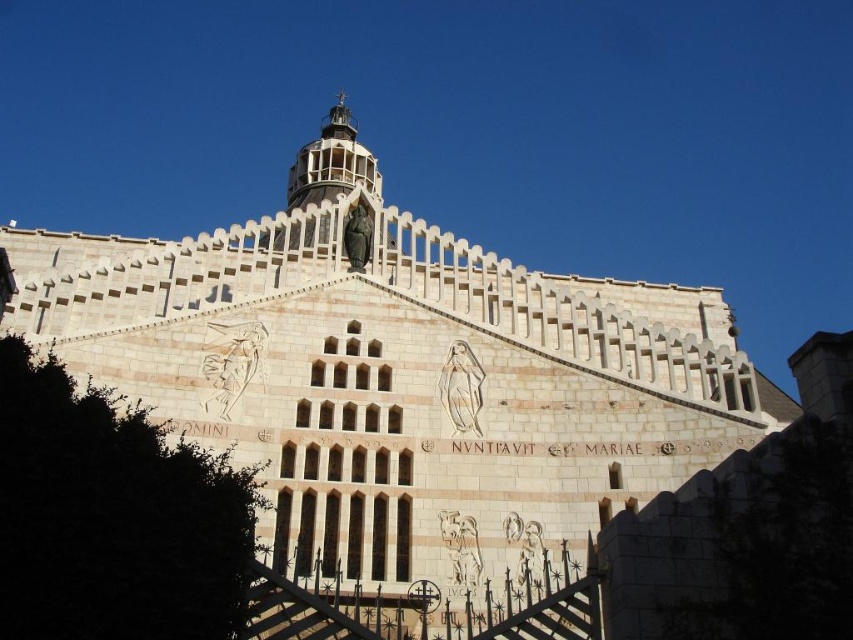
Question: Can you confirm if dark green leafy tree at lower left is bigger than white lattice tower at upper center?

Choices:
 (A) no
 (B) yes

Answer: (A)

Question: Which point is closer to the camera?

Choices:
 (A) (344, 173)
 (B) (172, 556)

Answer: (B)

Question: Is dark green leafy tree at lower left to the left of white lattice tower at upper center from the viewer's perspective?

Choices:
 (A) yes
 (B) no

Answer: (B)

Question: Is dark green leafy tree at lower left above white lattice tower at upper center?

Choices:
 (A) yes
 (B) no

Answer: (B)

Question: Which of the following is the closest to the observer?

Choices:
 (A) white lattice tower at upper center
 (B) dark green leafy tree at lower left

Answer: (B)